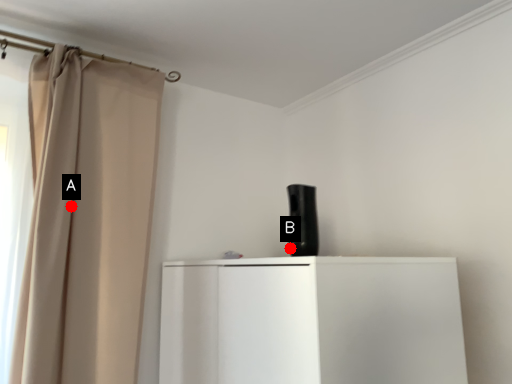
Question: Two points are circled on the image, labeled by A and B beside each circle. Which point is closer to the camera?

Choices:
 (A) A is closer
 (B) B is closer

Answer: (B)